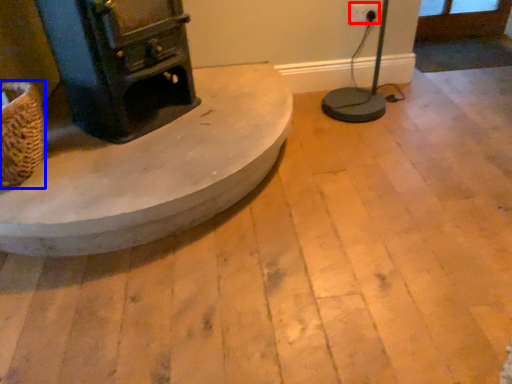
Question: Which object is further to the camera taking this photo, electric outlet (highlighted by a red box) or basket (highlighted by a blue box)?

Choices:
 (A) electric outlet
 (B) basket

Answer: (A)